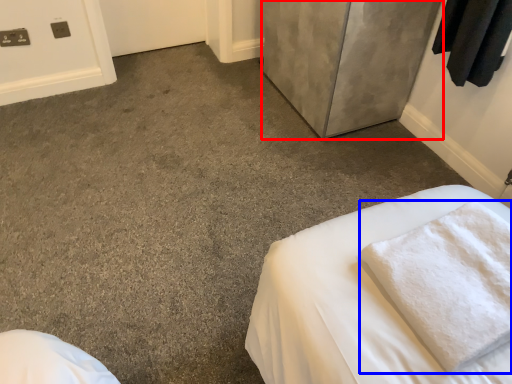
Question: Among these objects, which one is farthest to the camera, door (highlighted by a red box) or bath towel (highlighted by a blue box)?

Choices:
 (A) door
 (B) bath towel

Answer: (A)